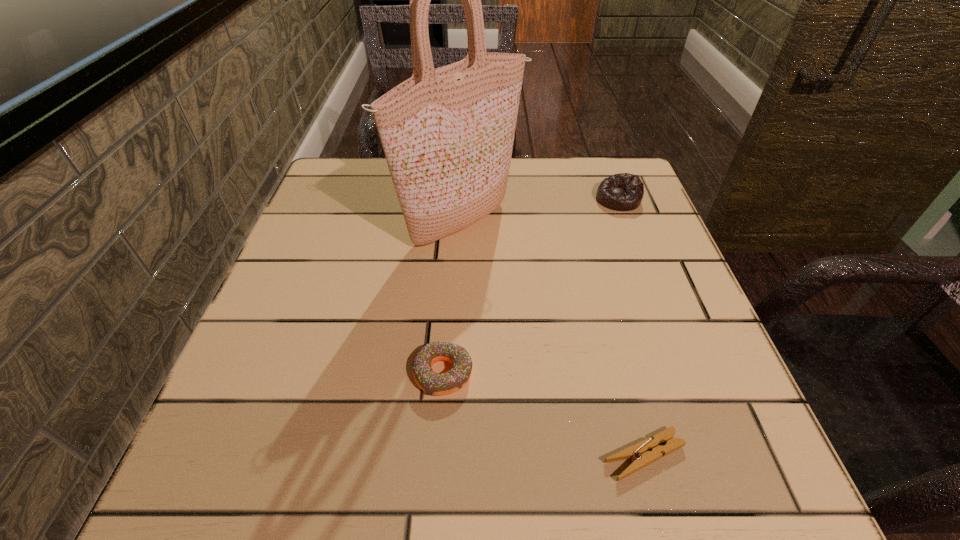
The height and width of the screenshot is (540, 960). In order to click on the tallest object in this screenshot , I will do `click(447, 133)`.

I want to click on beanbag, so click(x=623, y=192).

The image size is (960, 540). What are the coordinates of `doughnut` in the screenshot? It's located at (437, 384).

This screenshot has width=960, height=540. In order to click on the third tallest object in this screenshot , I will do `click(437, 384)`.

Find the location of a particular element. The width and height of the screenshot is (960, 540). clothespin is located at coordinates (647, 451).

Image resolution: width=960 pixels, height=540 pixels. Identify the location of the nearest object. (647, 451).

At what (x,y) coordinates should I click in order to perform the action: click on vacant space situated 0.110m on the back of the shopping bag. Please return your answer as a coordinate pair (x, y). Looking at the image, I should click on (464, 166).

You are a GUI agent. You are given a task and a screenshot of the screen. Output one action in this format:
    pyautogui.click(x=<x>, y=<y>)
    Task: Click on the vacant space situated on the front of the third shortest object
    
    Given the screenshot: What is the action you would take?
    pyautogui.click(x=633, y=238)

Image resolution: width=960 pixels, height=540 pixels. I want to click on free space located on the left of the doughnut, so click(x=298, y=373).

Find the location of a particular element. The image size is (960, 540). free spot located 0.190m on the back of the clothespin is located at coordinates (610, 325).